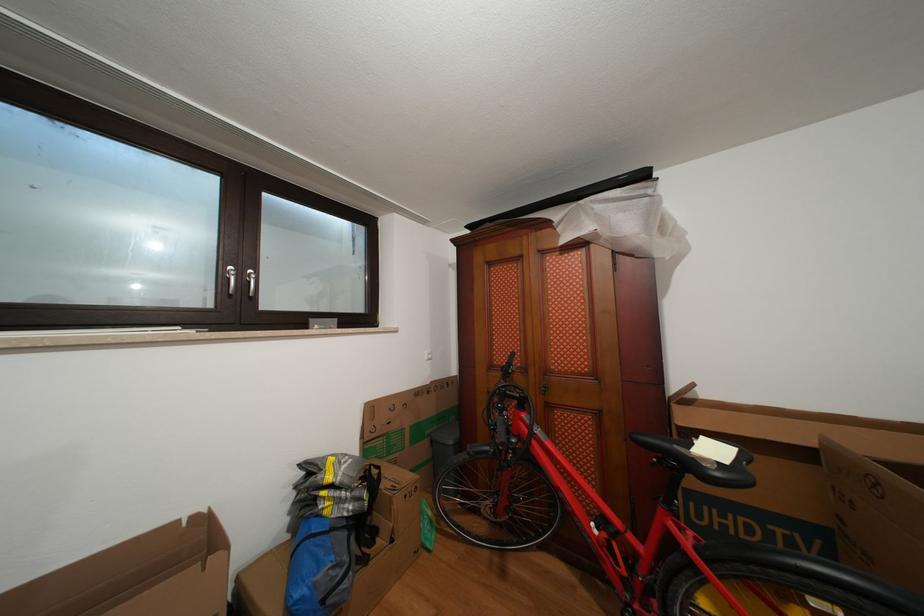
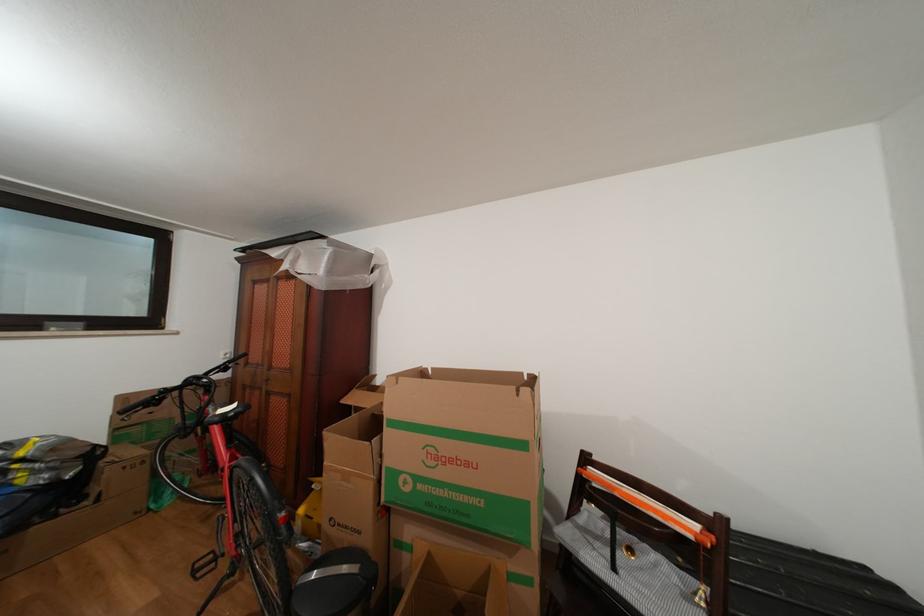
Where in the second image is the point corresponding to pixel 434 363 from the first image?

(229, 363)